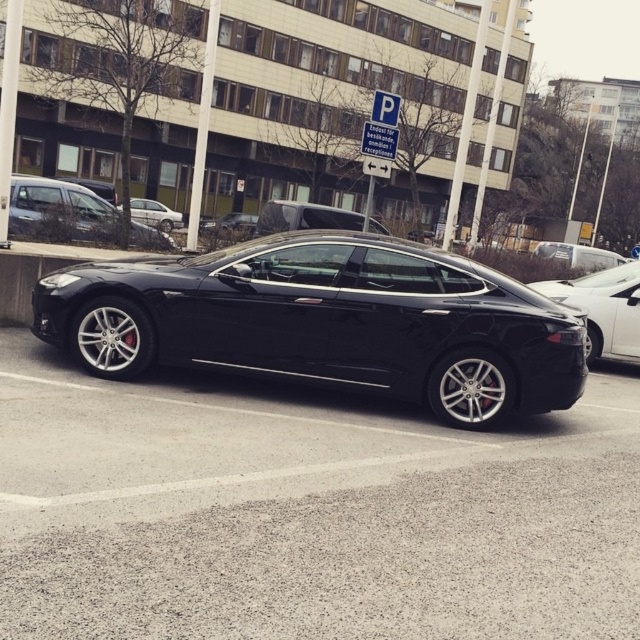
Based on the photo, you are a parking attendant checking the height of cars entering the garage. You see two cars labeled as matte black car at center and black matte car at center. Which one has a lower height?

The matte black car at center has a lesser height compared to the black matte car at center, so the matte black car at center is the lower one.

You are standing at the point with coordinates (604, 308) in the parking lot. You want to walk to the shiny silver sedan at center. Which direction should you head?

The shiny silver sedan at center is located in the direction away from the point (604, 308), so you should head towards the center of the parking lot to reach it.

You are standing at the entrance of the building and want to locate the black glossy car at center. According to the coordinate system where the bottom left corner is the origin, which quadrant would you find it in?

The black glossy car at center is located at coordinate point (305, 513). Since both coordinates are positive and the x value is greater than 0.5 while the y is less than 0.5, it lies in the first quadrant but closer to the right edge. However, in standard quadrant division, the first quadrant is the top right, but here since y increases upwards, the coordinate system might be adjusted. Wait, the problem states the bottom left is the origin, so the first quadrant would be top right, but the coordinates 0.